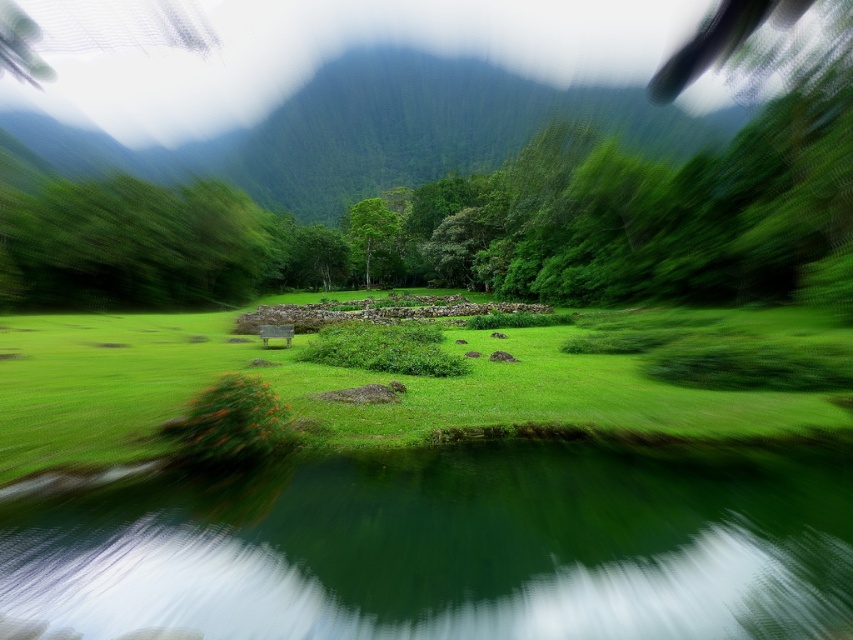
In the scene shown: Between green grassy at center and green leafy mountain at upper center, which one is positioned higher?

green leafy mountain at upper center

Between green grassy at center and green leafy mountain at upper center, which one has less height?

green grassy at center

Who is more distant from viewer, (x=712, y=403) or (x=415, y=113)?

The point (x=415, y=113) is more distant.

At what (x,y) coordinates should I click in order to perform the action: click on green grassy at center. Please return your answer as a coordinate pair (x, y). Image resolution: width=853 pixels, height=640 pixels. Looking at the image, I should click on (328, 388).

Is green smooth water at lower center taller than green grassy at center?

In fact, green smooth water at lower center may be shorter than green grassy at center.

Is point (138, 499) behind point (10, 358)?

No, (138, 499) is closer to viewer.

Which is in front, point (390, 518) or point (152, 394)?

Positioned in front is point (390, 518).

You are a GUI agent. You are given a task and a screenshot of the screen. Output one action in this format:
    pyautogui.click(x=<x>, y=<y>)
    Task: Click on the green smooth water at lower center
    Image resolution: width=853 pixels, height=640 pixels.
    Given the screenshot: What is the action you would take?
    pyautogui.click(x=450, y=548)

This screenshot has width=853, height=640. Describe the element at coordinates (328, 388) in the screenshot. I see `green grassy at center` at that location.

Is point (281, 348) closer to camera compared to point (366, 257)?

Yes, point (281, 348) is in front of point (366, 257).

Describe the element at coordinates (328, 388) in the screenshot. I see `green grassy at center` at that location.

Where is `green grassy at center`? The height and width of the screenshot is (640, 853). green grassy at center is located at coordinates (328, 388).